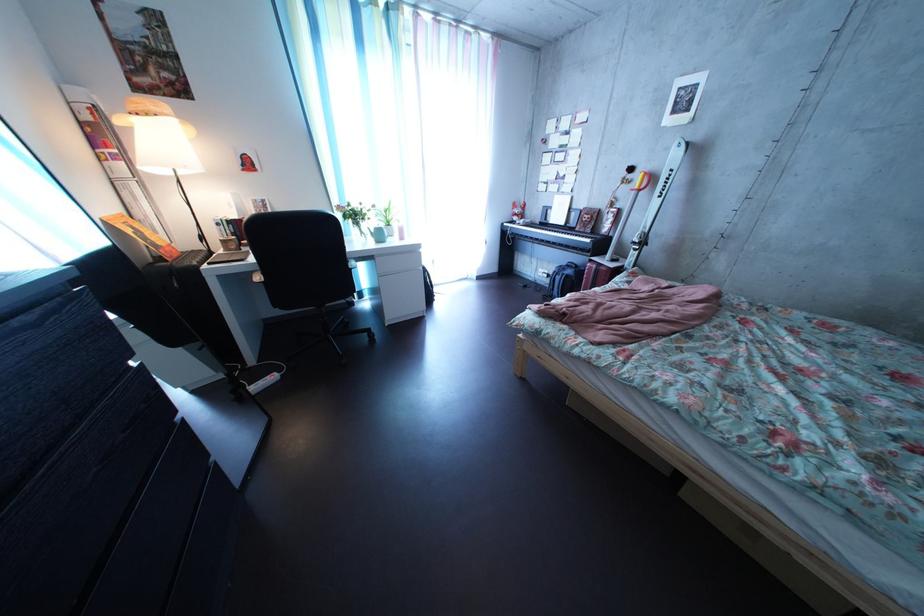
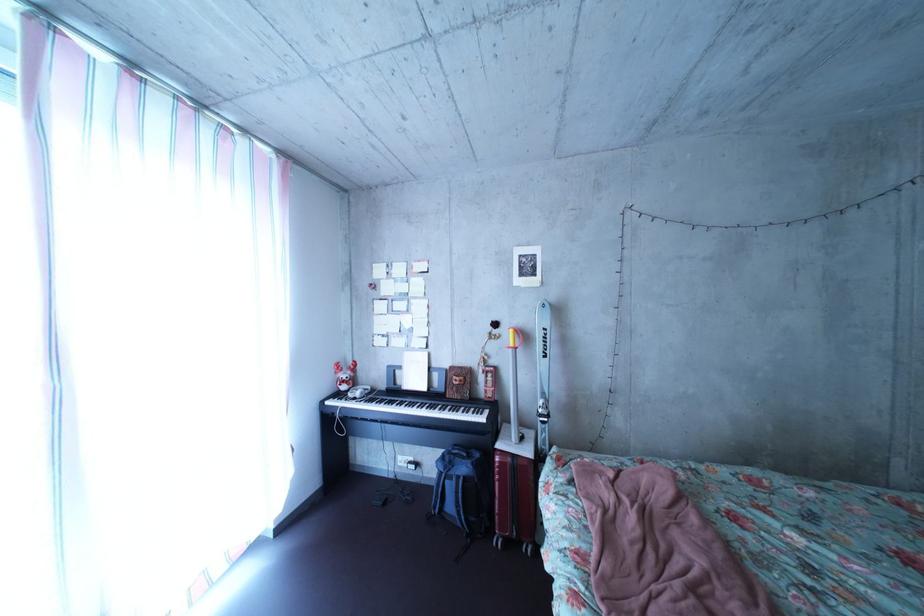
Locate, in the second image, the point that corresponds to [643,185] in the first image.

(509, 339)